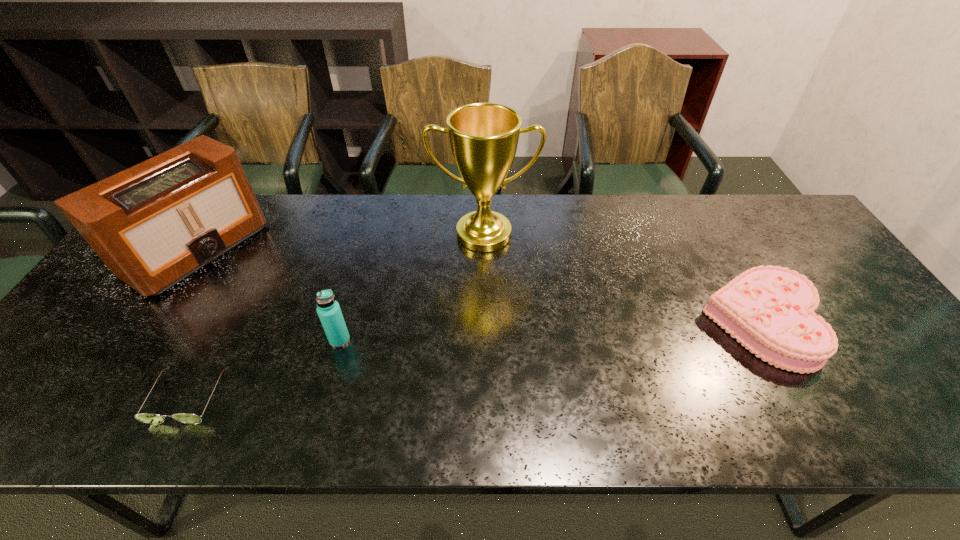
You are a GUI agent. You are given a task and a screenshot of the screen. Output one action in this format:
    pyautogui.click(x=<x>, y=<y>)
    Task: Click on the blank region between the third shortest object and the shortest object
    Image resolution: width=960 pixels, height=540 pixels.
    Given the screenshot: What is the action you would take?
    pyautogui.click(x=264, y=368)

The width and height of the screenshot is (960, 540). I want to click on free point between the radio receiver and the cake, so click(480, 286).

Find the location of `the closest object to the third shortest object`. the closest object to the third shortest object is located at coordinates (149, 418).

Select which object is the third closest to the sunglasses. Please provide its 2D coordinates. Your answer should be formatted as a tuple, i.e. [(x, y)], where the tuple contains the x and y coordinates of a point satisfying the conditions above.

[(484, 137)]

Where is `free space that satisfies the following two spatial constraints: 1. on the front side of the radio receiver; 2. on the right side of the rightmost object`? The height and width of the screenshot is (540, 960). free space that satisfies the following two spatial constraints: 1. on the front side of the radio receiver; 2. on the right side of the rightmost object is located at coordinates (148, 323).